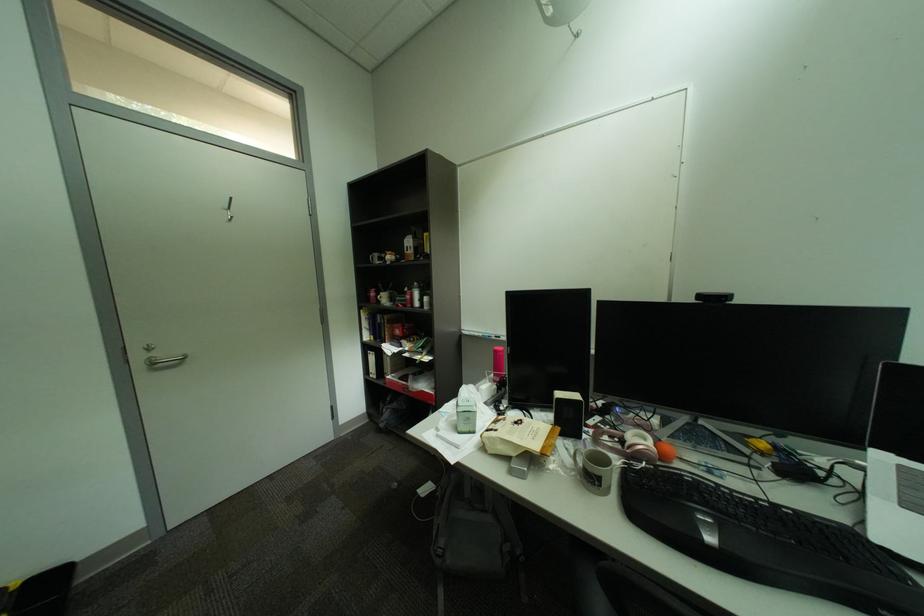
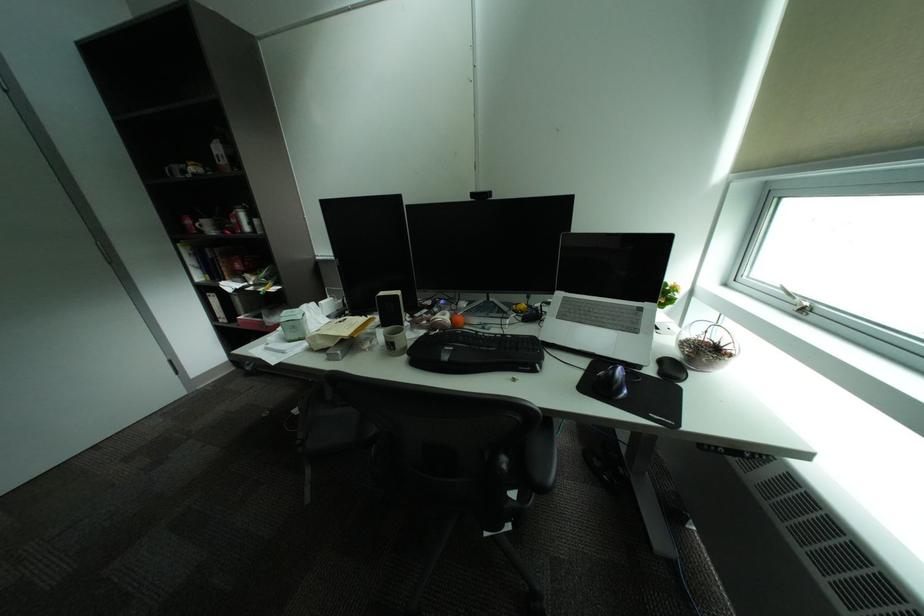
The point at (424, 390) is marked in the first image. Where is the corresponding point in the second image?

(281, 323)